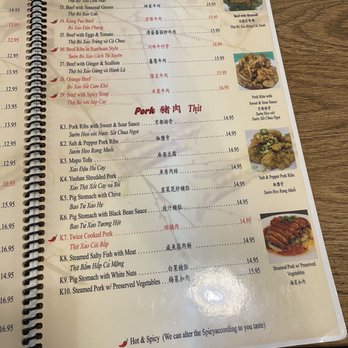
You are a GUI agent. You are given a task and a screenshot of the screen. Output one action in this format:
    pyautogui.click(x=<x>, y=<y>)
    Task: Click on the brown table
    This screenshot has height=348, width=348.
    Given the screenshot: What is the action you would take?
    pyautogui.click(x=303, y=16), pyautogui.click(x=341, y=281), pyautogui.click(x=328, y=191), pyautogui.click(x=333, y=24), pyautogui.click(x=329, y=112)